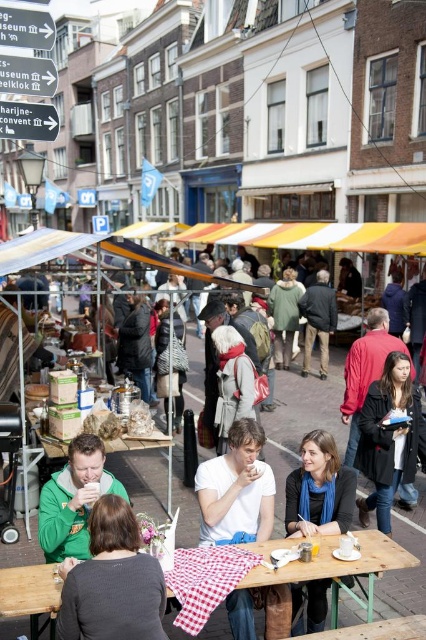
Question: Among these points, which one is nearest to the camera?

Choices:
 (A) (348, 522)
 (B) (221, 509)

Answer: (A)

Question: Is the position of matte black jacket at right more distant than that of green matte jacket at lower left?

Choices:
 (A) yes
 (B) no

Answer: (A)

Question: In this image, where is wooden picnic table at center located relative to green matte jacket at lower left?

Choices:
 (A) right
 (B) left

Answer: (A)

Question: Estimate the real-world distances between objects in this image. Which object is closer to the wooden picnic table at center?

Choices:
 (A) green matte jacket at lower left
 (B) blue scarf at lower center
 (C) green knit sweater at lower left
 (D) matte black jacket at right

Answer: (B)

Question: Is white cotton shirt at center closer to camera compared to green matte jacket at lower left?

Choices:
 (A) no
 (B) yes

Answer: (A)

Question: Which object is farther from the camera taking this photo?

Choices:
 (A) white cotton shirt at center
 (B) green knit sweater at lower left
 (C) wooden picnic table at center

Answer: (A)